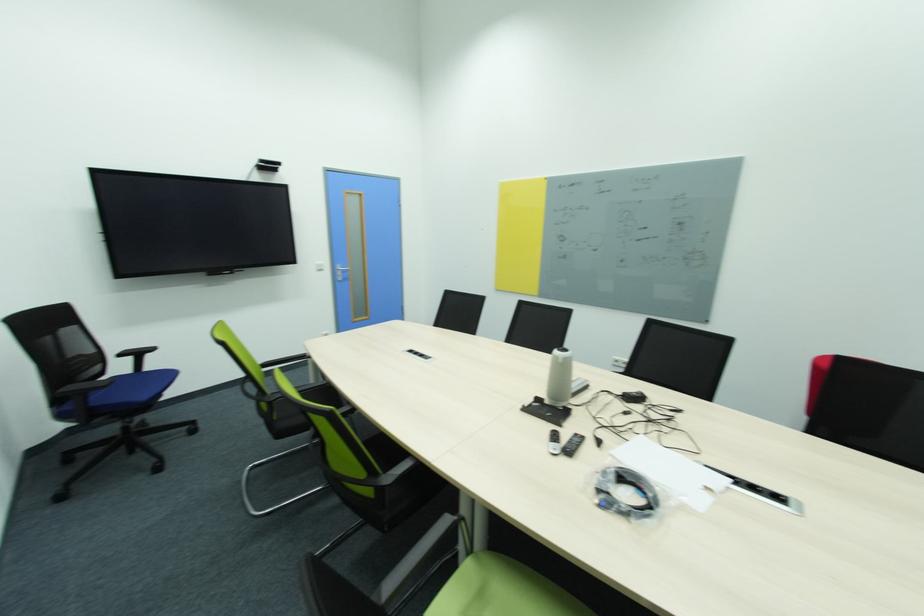
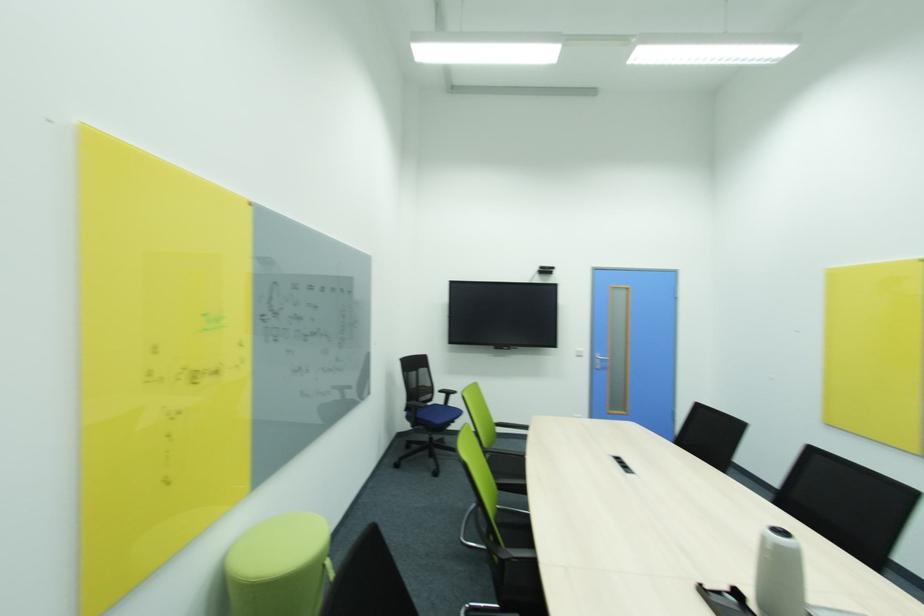
Find the pixel in the second image that matches the point at 149,397 in the first image.

(442, 422)